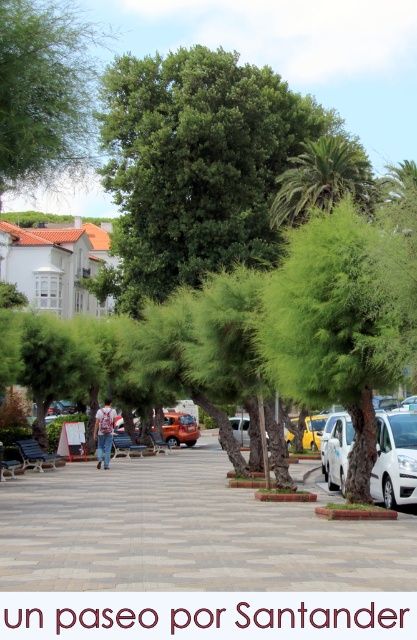
Question: Which point is closer to the camera?

Choices:
 (A) green leafy palm at upper center
 (B) green leafy tree at upper left
 (C) orange matte car at center
 (D) green fuzzy tree at center

Answer: (B)

Question: Which object is the closest to the gray stone pavement at center?

Choices:
 (A) green fuzzy tree at center
 (B) white matte van at center-right
 (C) green leafy tree at upper left
 (D) camouflage shirt at center

Answer: (B)

Question: Can you confirm if green leafy tree at upper left is positioned above camouflage shirt at center?

Choices:
 (A) no
 (B) yes

Answer: (B)

Question: Estimate the real-world distances between objects in this image. Which object is farther from the orange matte car at center?

Choices:
 (A) camouflage shirt at center
 (B) green leafy tree at upper left
 (C) green fuzzy tree at center
 (D) gray stone pavement at center

Answer: (C)

Question: Is gray stone pavement at center bigger than green leafy palm at upper center?

Choices:
 (A) no
 (B) yes

Answer: (A)

Question: Can you confirm if green fuzzy tree at center is wider than yellow matte car at center?

Choices:
 (A) yes
 (B) no

Answer: (B)